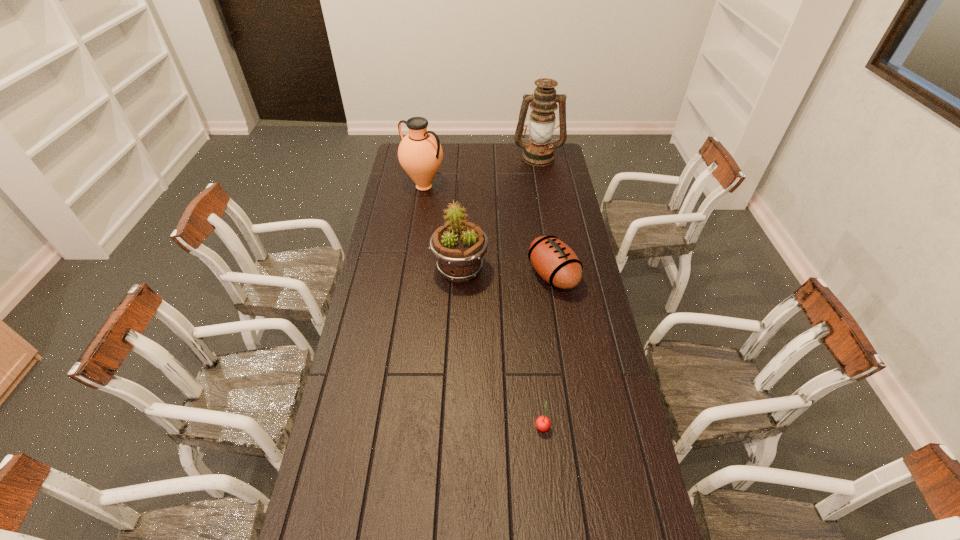
This screenshot has width=960, height=540. Identify the location of vacant space located 0.050m on the front of the football (American). (558, 309).

You are a GUI agent. You are given a task and a screenshot of the screen. Output one action in this format:
    pyautogui.click(x=<x>, y=<y>)
    Task: Click on the free space located 0.160m on the left of the cherry
    The height and width of the screenshot is (540, 960).
    Given the screenshot: What is the action you would take?
    pyautogui.click(x=481, y=426)

The width and height of the screenshot is (960, 540). I want to click on object that is at the far edge, so click(x=538, y=152).

The image size is (960, 540). Identify the location of object present at the left edge. (420, 153).

Identify the location of lantern that is at the right edge. (538, 152).

Locate an element on the screen. The height and width of the screenshot is (540, 960). football (American) at the right edge is located at coordinates (554, 261).

Identify the location of object situated at the far right corner. (538, 152).

Image resolution: width=960 pixels, height=540 pixels. In the image, there is a desktop. What are the coordinates of `vacant space at the far edge` in the screenshot? It's located at (525, 167).

I want to click on vacant space at the left edge, so click(368, 368).

In the image, there is a desktop. At what (x,y) coordinates should I click in order to perform the action: click on vacant space at the right edge. Please return your answer as a coordinate pair (x, y). Looking at the image, I should click on (556, 195).